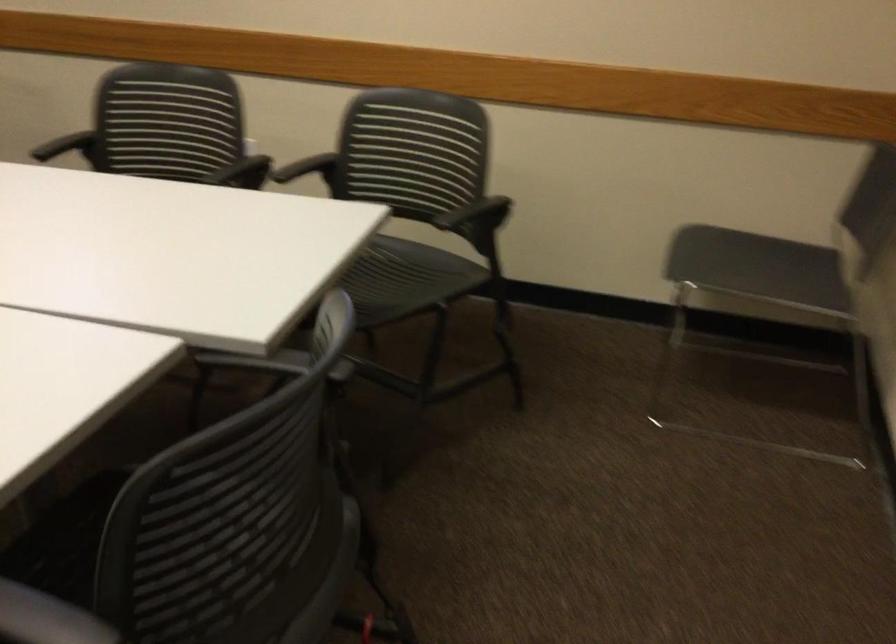
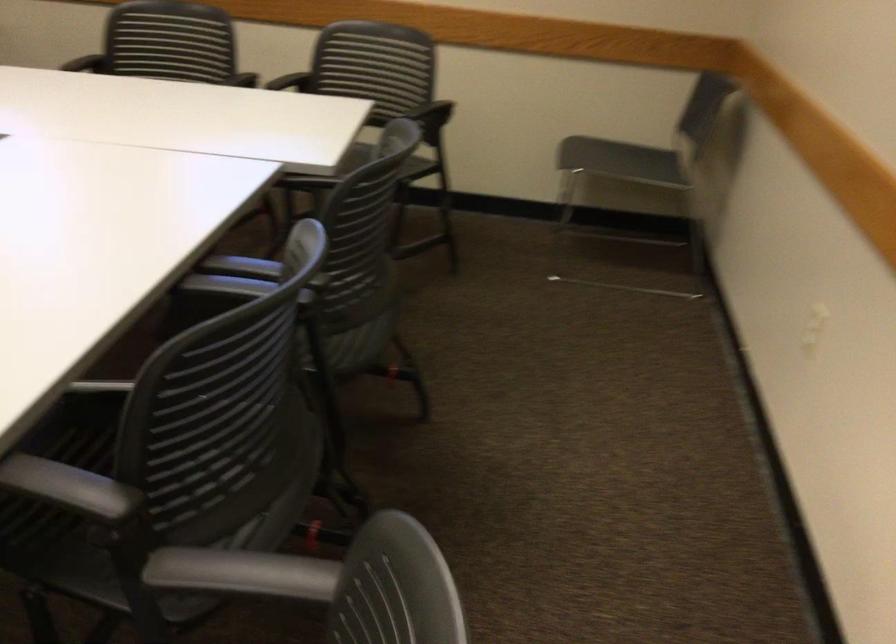
Where in the second image is the point corresponding to the point at 415,156 from the first image?

(375, 73)